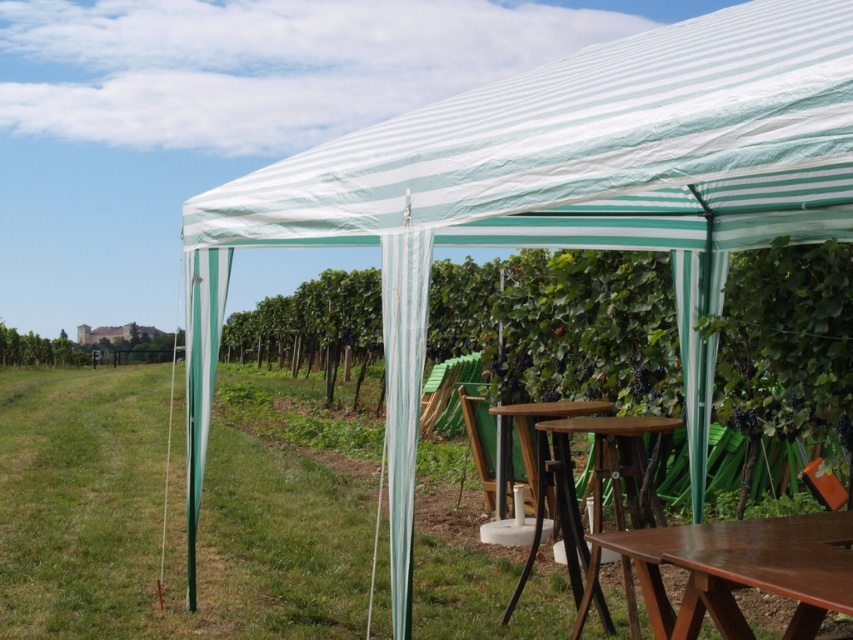
Question: Which point appears closest to the camera in this image?

Choices:
 (A) (477, 406)
 (B) (281, 596)
 (C) (553, 456)

Answer: (C)

Question: Which of the following is the farthest from the observer?

Choices:
 (A) wooden picnic table at center
 (B) green grass at center
 (C) wooden at center
 (D) brown wooden table at lower right

Answer: (C)

Question: Considering the relative positions of wooden picnic table at center and brown wooden table at lower right in the image provided, where is wooden picnic table at center located with respect to brown wooden table at lower right?

Choices:
 (A) below
 (B) above

Answer: (A)

Question: Among these objects, which one is farthest from the camera?

Choices:
 (A) wooden picnic table at center
 (B) brown wooden table at lower right
 (C) wooden at center

Answer: (C)

Question: Is wooden picnic table at center thinner than brown wooden table at lower right?

Choices:
 (A) yes
 (B) no

Answer: (B)

Question: Observing the image, what is the correct spatial positioning of wooden picnic table at center in reference to wooden at center?

Choices:
 (A) right
 (B) left

Answer: (A)